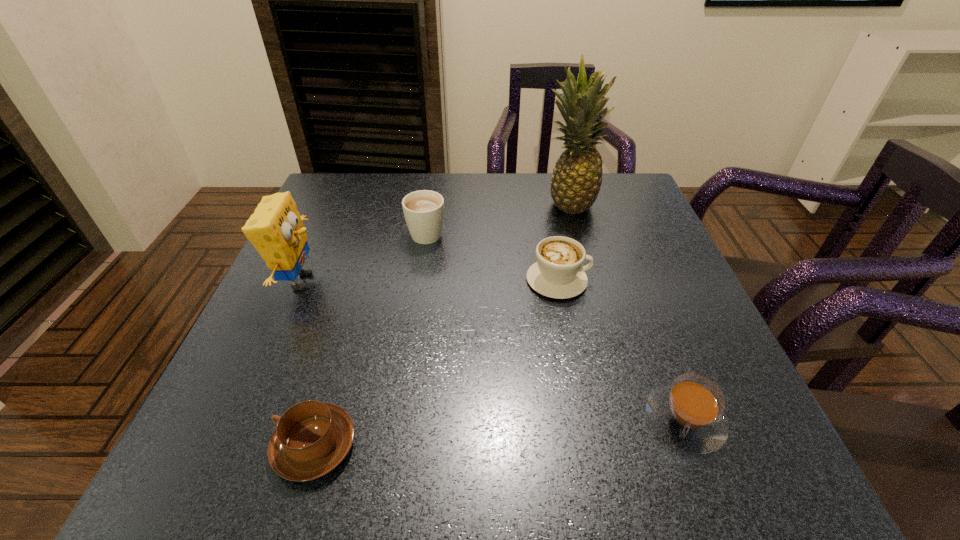
This screenshot has height=540, width=960. What are the coordinates of `cappuccino that is the third closest to the third cappuccino from left to right` in the screenshot? It's located at (312, 438).

This screenshot has height=540, width=960. Identify the location of cappuccino that stands as the closest to the third tallest object. (558, 273).

Find the location of a particular element. The height and width of the screenshot is (540, 960). free spot that satisfies the following two spatial constraints: 1. with the handle on the side of the pineapple; 2. on the left side of the tallest cappuccino is located at coordinates [431, 205].

This screenshot has width=960, height=540. I want to click on free space that satisfies the following two spatial constraints: 1. on the face of the sponge; 2. on the left side of the rightmost cappuccino, so click(x=240, y=420).

At what (x,y) coordinates should I click in order to perform the action: click on free point that satisfies the following two spatial constraints: 1. with the handle on the side of the farthest cappuccino; 2. on the right side of the tallest object. Please return your answer as a coordinate pair (x, y). This screenshot has height=540, width=960. Looking at the image, I should click on click(431, 205).